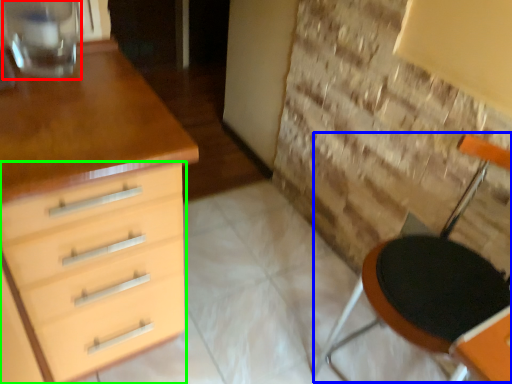
Question: Based on their relative distances, which object is nearer to glass vase (highlighted by a red box)? Choose from armchair (highlighted by a blue box) and chest of drawers (highlighted by a green box).

Choices:
 (A) armchair
 (B) chest of drawers

Answer: (B)